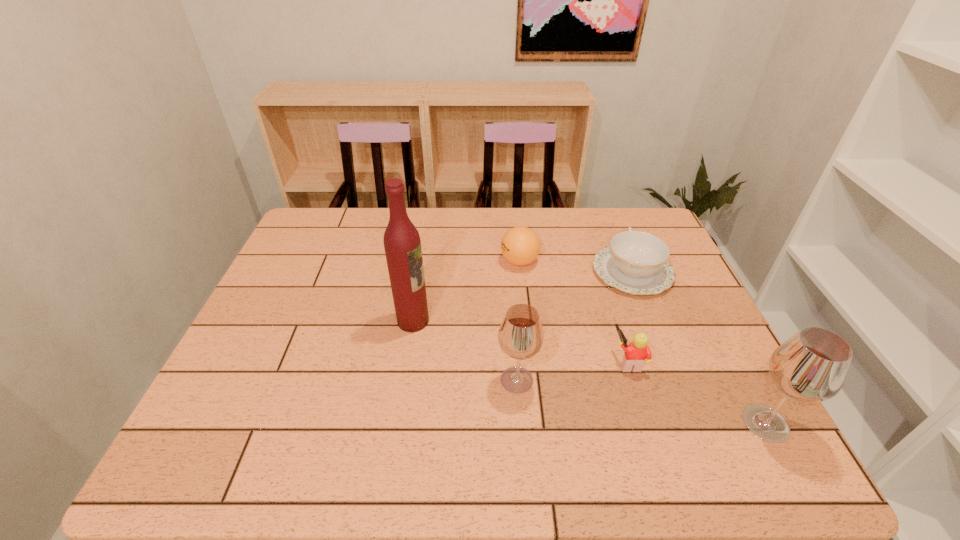
Locate an element on the screen. This screenshot has width=960, height=540. the farther wineglass is located at coordinates (520, 336).

Locate an element on the screen. the left wineglass is located at coordinates (520, 336).

At what (x,y) coordinates should I click in order to perform the action: click on the nearer wineglass. Please return your answer as a coordinate pair (x, y). Image resolution: width=960 pixels, height=540 pixels. Looking at the image, I should click on (811, 366).

You are a GUI agent. You are given a task and a screenshot of the screen. Output one action in this format:
    pyautogui.click(x=<x>, y=<y>)
    Task: Click on the nearest object
    The height and width of the screenshot is (540, 960).
    Given the screenshot: What is the action you would take?
    click(811, 366)

You are a GUI agent. You are given a task and a screenshot of the screen. Output one action in this format:
    pyautogui.click(x=<x>, y=<y>)
    Task: Click on the leftmost object
    
    Given the screenshot: What is the action you would take?
    pyautogui.click(x=402, y=244)

You are a GUI agent. You are given a task and a screenshot of the screen. Output one action in this format:
    pyautogui.click(x=<x>, y=<y>)
    Task: Click on the third farthest object
    The height and width of the screenshot is (540, 960).
    Given the screenshot: What is the action you would take?
    pyautogui.click(x=402, y=244)

What are the coordinates of `chinaware` in the screenshot? It's located at (635, 262).

You are a GUI agent. You are given a task and a screenshot of the screen. Output one action in this format:
    pyautogui.click(x=<x>, y=<y>)
    Task: Click on the ping-pong ball
    Image resolution: width=960 pixels, height=540 pixels.
    Given the screenshot: What is the action you would take?
    pyautogui.click(x=520, y=245)

This screenshot has width=960, height=540. Identify the location of Lego. (637, 352).

You are a GUI agent. You are given a task and a screenshot of the screen. Output one action in this format:
    pyautogui.click(x=<x>, y=<y>)
    Task: Click on the vacant space situated on the left of the shorter wineglass
    This screenshot has height=540, width=960.
    Given the screenshot: What is the action you would take?
    pyautogui.click(x=335, y=380)